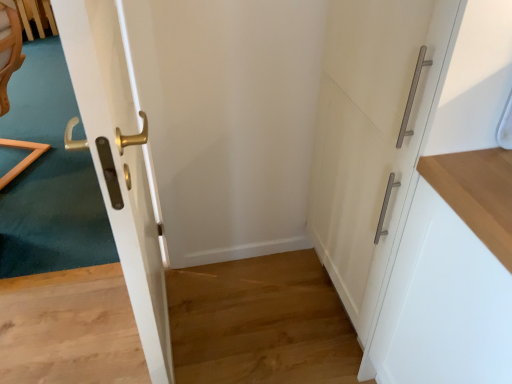
You are a GUI agent. You are given a task and a screenshot of the screen. Output one action in this format:
    pyautogui.click(x=<x>, y=<y>)
    Task: Click on the unoccupied region to the right of glossy white door at left, which is the second door from right to left
    
    Given the screenshot: What is the action you would take?
    pyautogui.click(x=248, y=326)